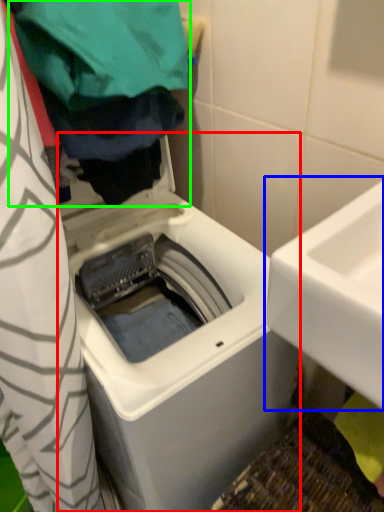
Question: Considering the real-world distances, which object is closest to washing machine (highlighted by a red box)? sink (highlighted by a blue box) or clothing (highlighted by a green box).

Choices:
 (A) sink
 (B) clothing

Answer: (A)